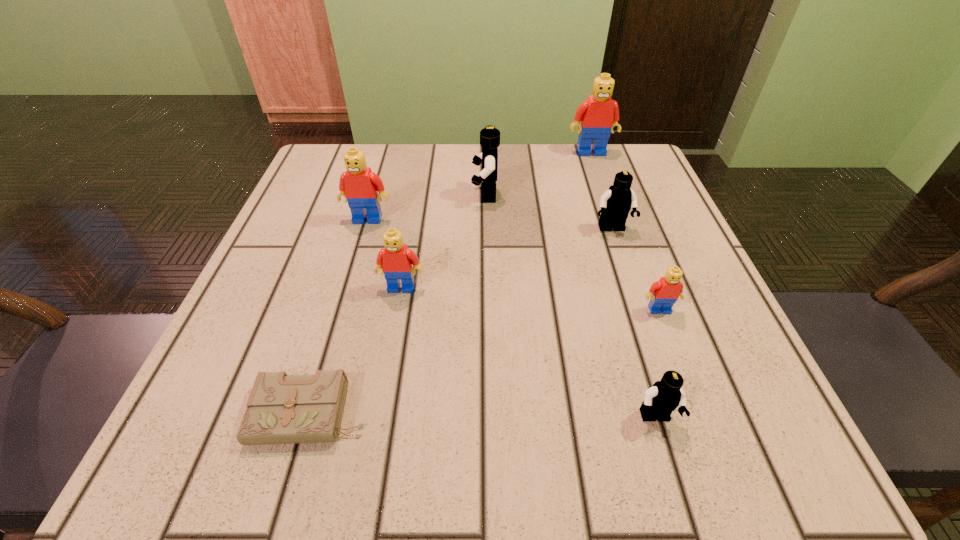
In order to click on the third nearest object in this screenshot , I will do `click(664, 293)`.

In order to click on the smallest black Lego in this screenshot , I will do `click(664, 396)`.

Find the location of a particular element. the nearest Lego is located at coordinates [664, 396].

Identify the location of green diary. This screenshot has width=960, height=540. (281, 409).

Where is `the shortest object`? the shortest object is located at coordinates (281, 409).

This screenshot has width=960, height=540. What are the coordinates of `vacant region located 0.390m on the face of the farthest object` in the screenshot? It's located at (634, 273).

Where is `blank space located on the front-facing side of the leftmost black Lego`? blank space located on the front-facing side of the leftmost black Lego is located at coordinates (420, 194).

This screenshot has width=960, height=540. Find the location of `vacant space located 0.050m on the front-facing side of the leftmost black Lego`. vacant space located 0.050m on the front-facing side of the leftmost black Lego is located at coordinates (447, 194).

Identify the location of free space located 0.190m on the front-facing side of the leftmost black Lego. (381, 194).

At what (x,y) coordinates should I click in order to perform the action: click on vacant point located on the face of the third nearest red Lego. Please return your answer as a coordinate pair (x, y). Image resolution: width=960 pixels, height=540 pixels. Looking at the image, I should click on (328, 353).